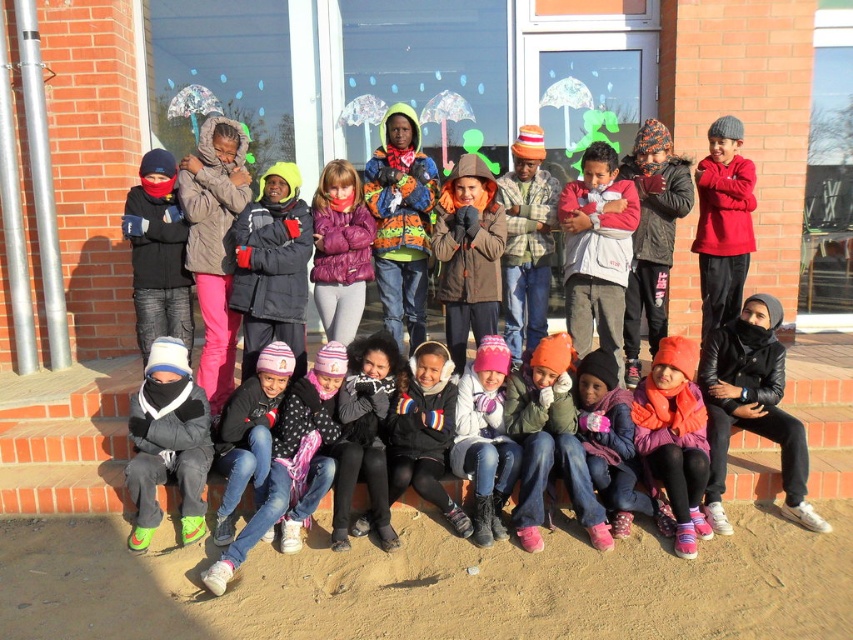
You are taking a photo of the children in front of the brick building. You want to focus on the point at coordinates point (639, 406) and point (328, 326). Which point should you focus on first to ensure both are in focus?

Point (639, 406) is closer to the camera than point (328, 326). To ensure both points are in focus, focus on the closer point first, which is point (639, 406).

You are a photographer trying to capture a group photo of the children. The pink woolen hat at center and the purple puffy jacket at center are both in your view. If you want to ensure both are in focus, what should you consider about their distance?

The distance between the pink woolen hat at center and the purple puffy jacket at center is 3.63 feet. To ensure both are in focus, you should set the camera focus to account for this distance.

You are a photographer trying to capture a photo of the children in front of the brick building. You notice two points marked in the image at coordinates point (683, 476) and point (497, 355). Which point is closer to the camera based on their positions?

Point (683, 476) is in front of point (497, 355), so it is closer to the camera.